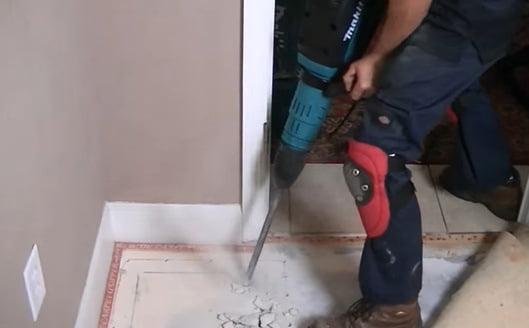
The width and height of the screenshot is (529, 328). Identify the location of wall. pyautogui.click(x=43, y=200), pyautogui.click(x=178, y=156).